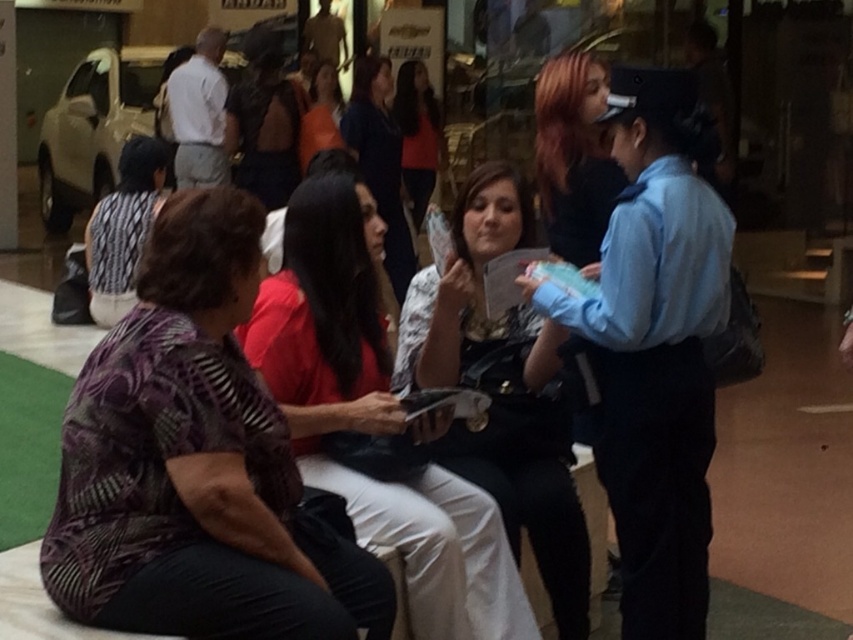
You are a photographer trying to capture a candid shot of both the printed fabric blouse at left and the matte black shirt at center. Based on their positions, which one should you focus on first to ensure both are in the frame?

The printed fabric blouse at left is to the left of the matte black shirt at center, so you should focus on the matte black shirt at center first to ensure both are in the frame.

You are a fashion designer observing the scene and notice two garments at the center of the table. The garments are labeled as the printed fabric blouse at center and the matte black shirt at center. Which of these garments is smaller in size?

The printed fabric blouse at center is smaller than the matte black shirt at center.